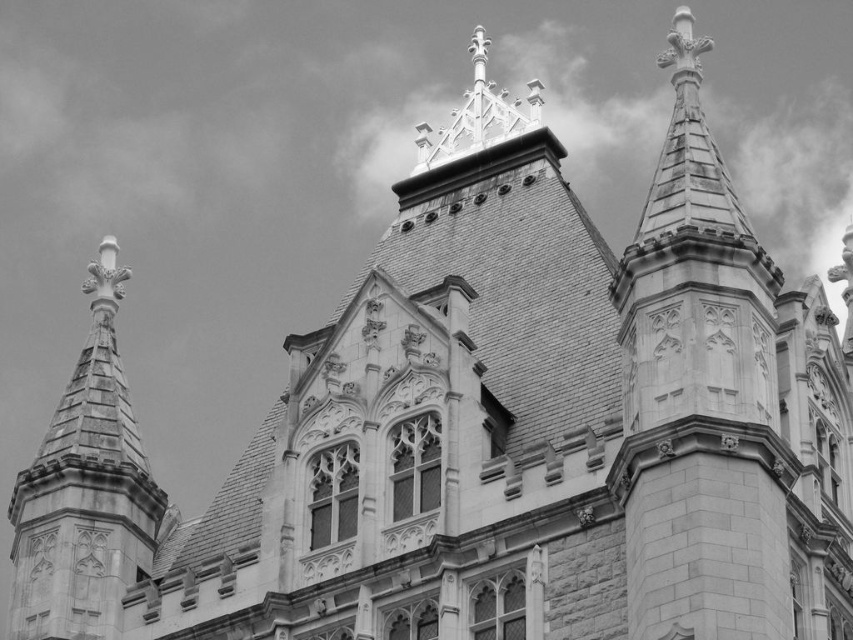
Question: Does white stone steeple at upper right appear over stone spire at left?

Choices:
 (A) no
 (B) yes

Answer: (B)

Question: Which point appears farthest from the camera in this image?

Choices:
 (A) (677, 609)
 (B) (77, 433)

Answer: (B)

Question: Which object is farther from the camera taking this photo?

Choices:
 (A) white stone steeple at upper right
 (B) stone spire at left

Answer: (B)

Question: Can you confirm if white stone steeple at upper right is positioned to the left of stone spire at left?

Choices:
 (A) yes
 (B) no

Answer: (B)

Question: Which point appears farthest from the camera in this image?

Choices:
 (A) (144, 548)
 (B) (743, 440)

Answer: (A)

Question: Is white stone steeple at upper right smaller than stone spire at left?

Choices:
 (A) no
 (B) yes

Answer: (B)